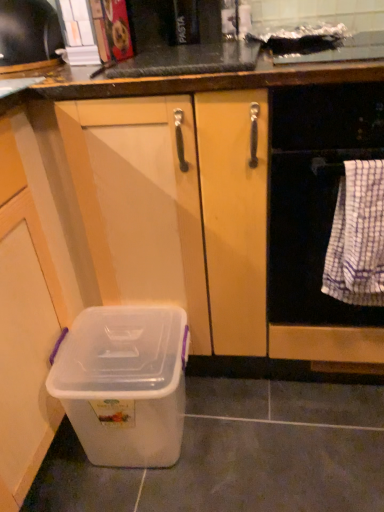
Question: In terms of height, does white checkered towel at right look taller or shorter compared to white woven towel at right?

Choices:
 (A) tall
 (B) short

Answer: (B)

Question: Looking at their shapes, would you say white checkered towel at right is wider or thinner than white woven towel at right?

Choices:
 (A) thin
 (B) wide

Answer: (A)

Question: Estimate the real-world distances between objects in this image. Which object is farther from the white checkered towel at right?

Choices:
 (A) metallic silver toaster at upper left
 (B) transparent plastic storage box at lower left
 (C) white woven towel at right

Answer: (A)

Question: Which of these objects is positioned farthest from the white woven towel at right?

Choices:
 (A) white checkered towel at right
 (B) metallic silver toaster at upper left
 (C) transparent plastic storage box at lower left

Answer: (B)